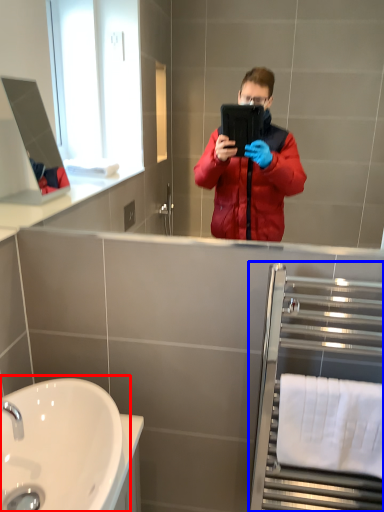
Question: Which object is further to the camera taking this photo, sink (highlighted by a red box) or balustrade (highlighted by a blue box)?

Choices:
 (A) sink
 (B) balustrade

Answer: (B)